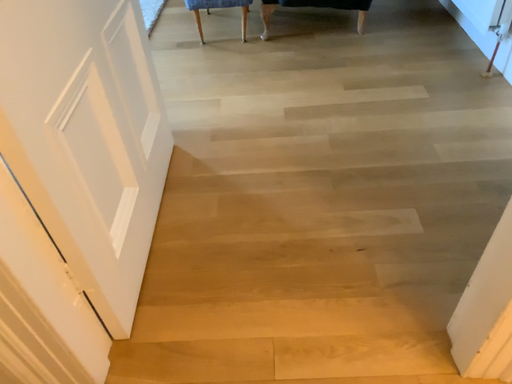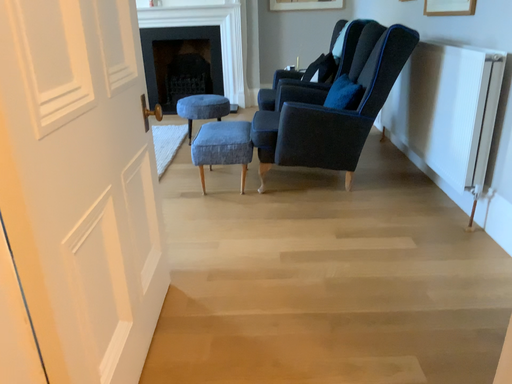
Question: How did the camera likely rotate when shooting the video?

Choices:
 (A) rotated upward
 (B) rotated downward

Answer: (A)